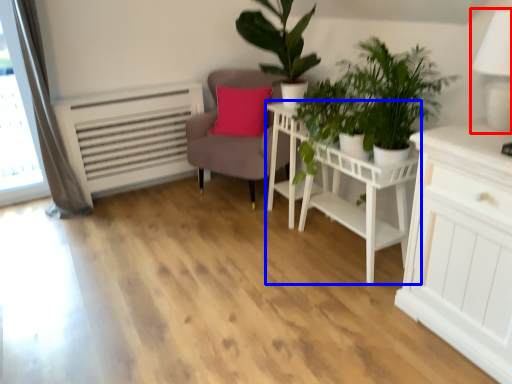
Question: Which object is further to the camera taking this photo, table lamp (highlighted by a red box) or table (highlighted by a blue box)?

Choices:
 (A) table lamp
 (B) table

Answer: (B)